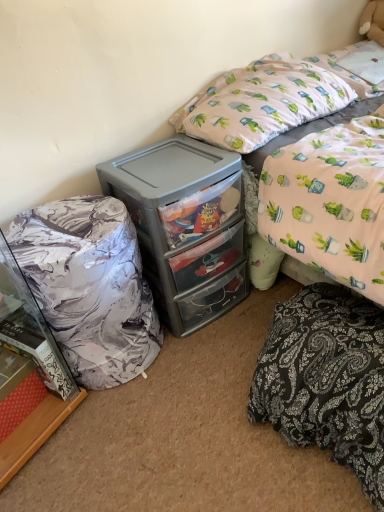
Image resolution: width=384 pixels, height=512 pixels. I want to click on free space between marble-patterned bean bag at left and black paisley fabric at lower right, so click(203, 399).